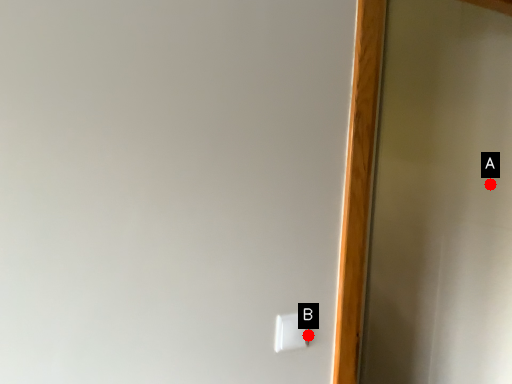
Question: Two points are circled on the image, labeled by A and B beside each circle. Among these points, which one is farthest from the camera?

Choices:
 (A) A is further
 (B) B is further

Answer: (A)